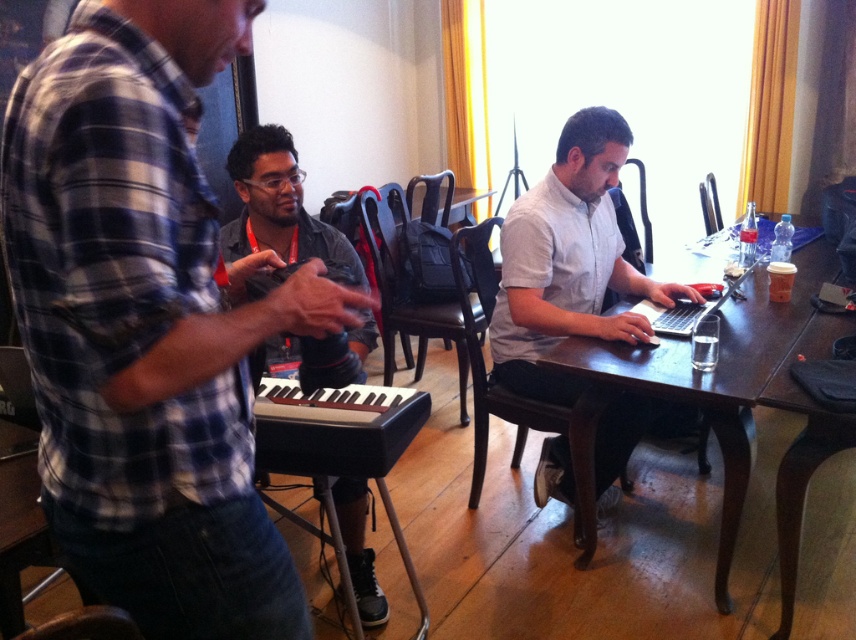
Question: Which point is closer to the camera?

Choices:
 (A) white matte shirt at center
 (B) matte black keyboard at center

Answer: (B)

Question: Is matte black keyboard at center closer to the viewer compared to black leather piano at center?

Choices:
 (A) no
 (B) yes

Answer: (B)

Question: Is matte black keyboard at center wider than black leather piano at center?

Choices:
 (A) yes
 (B) no

Answer: (A)

Question: Is plaid shirt at left below black leather piano at center?

Choices:
 (A) yes
 (B) no

Answer: (B)

Question: Which of the following is the farthest from the observer?

Choices:
 (A) matte black keyboard at center
 (B) silver metallic laptop at center

Answer: (B)

Question: Among these objects, which one is farthest from the camera?

Choices:
 (A) brown wooden table at center
 (B) matte black keyboard at center
 (C) plaid shirt at left

Answer: (A)